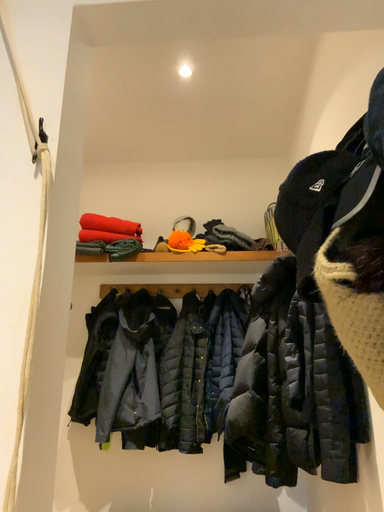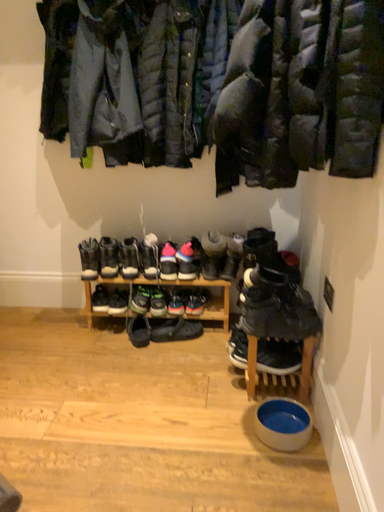
Question: How did the camera likely rotate when shooting the video?

Choices:
 (A) rotated downward
 (B) rotated upward

Answer: (A)